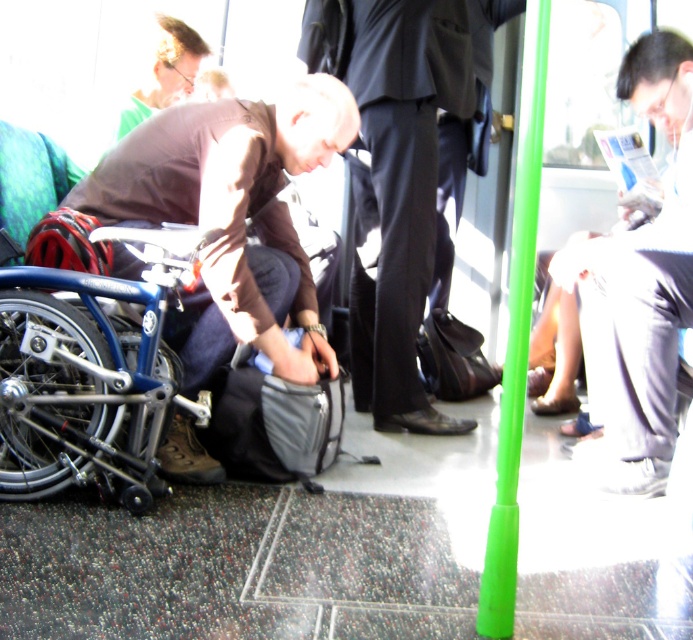
Does white paper at right come in front of matte brown shirt at upper left?

Yes, it is in front of matte brown shirt at upper left.

Which is in front, point (674, 436) or point (200, 45)?

Point (674, 436) is more forward.

What are the coordinates of `white paper at right` in the screenshot? It's located at (640, 285).

Is green plastic pole at center thinner than matte brown shirt at upper left?

Yes, green plastic pole at center is thinner than matte brown shirt at upper left.

Does green plastic pole at center appear under matte brown shirt at upper left?

Correct, green plastic pole at center is located below matte brown shirt at upper left.

I want to click on green plastic pole at center, so click(x=516, y=337).

At what (x,y) coordinates should I click in order to perform the action: click on green plastic pole at center. Please return your answer as a coordinate pair (x, y). Looking at the image, I should click on (516, 337).

Can you confirm if matte brown jacket at center is positioned to the right of matte brown shirt at upper left?

Correct, you'll find matte brown jacket at center to the right of matte brown shirt at upper left.

Is point (184, 438) closer to camera compared to point (146, 81)?

That is True.

Where is `matte brown jacket at center`? Image resolution: width=693 pixels, height=640 pixels. matte brown jacket at center is located at coordinates (231, 218).